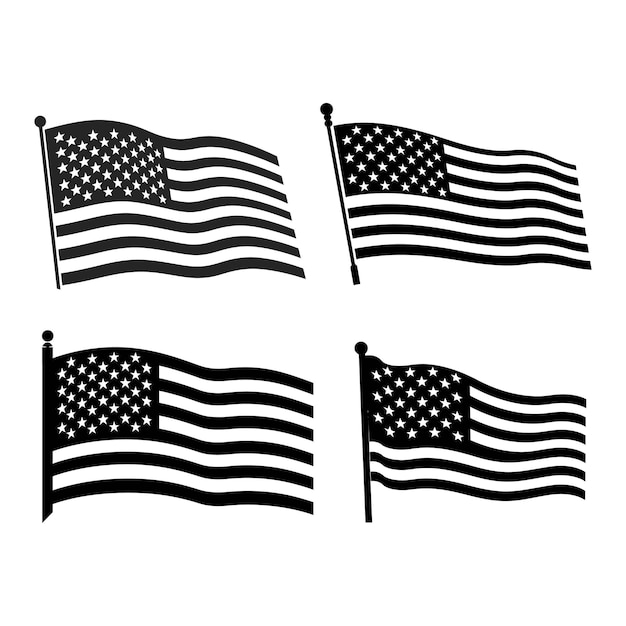
The height and width of the screenshot is (626, 626). Find the location of `finial`. finial is located at coordinates (47, 337), (39, 120), (327, 109), (360, 346).